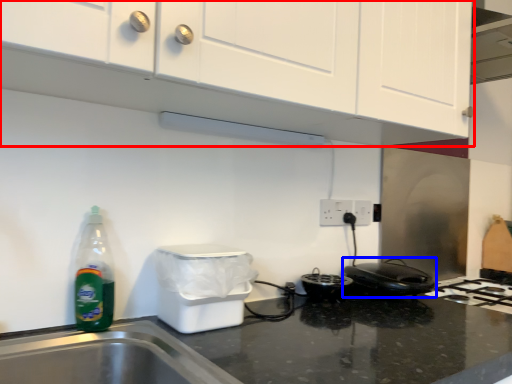
Question: Which object appears closest to the camera in this image, cabinetry (highlighted by a red box) or home appliance (highlighted by a blue box)?

Choices:
 (A) cabinetry
 (B) home appliance

Answer: (A)